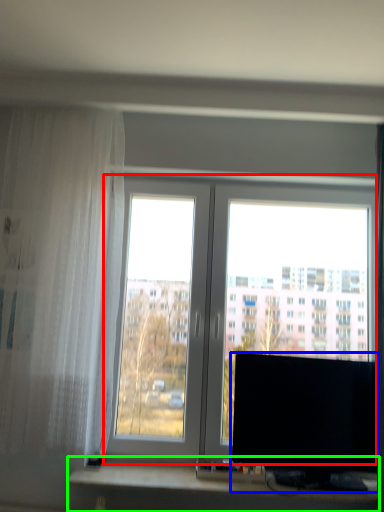
Question: Which object is positioned farthest from window (highlighted by a red box)? Select from computer monitor (highlighted by a blue box) and computer desk (highlighted by a green box).

Choices:
 (A) computer monitor
 (B) computer desk

Answer: (B)